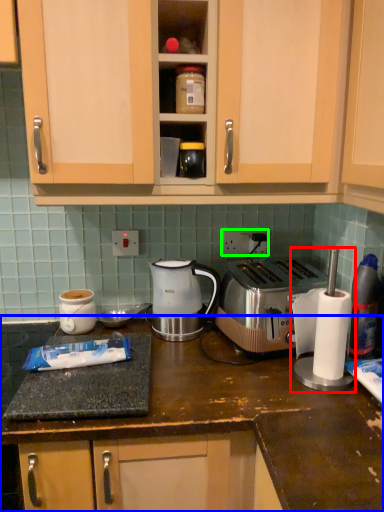
Question: Which object is positioned closest to blender (highlighted by a red box)? Select from countertop (highlighted by a blue box) and electric outlet (highlighted by a green box).

Choices:
 (A) countertop
 (B) electric outlet

Answer: (A)